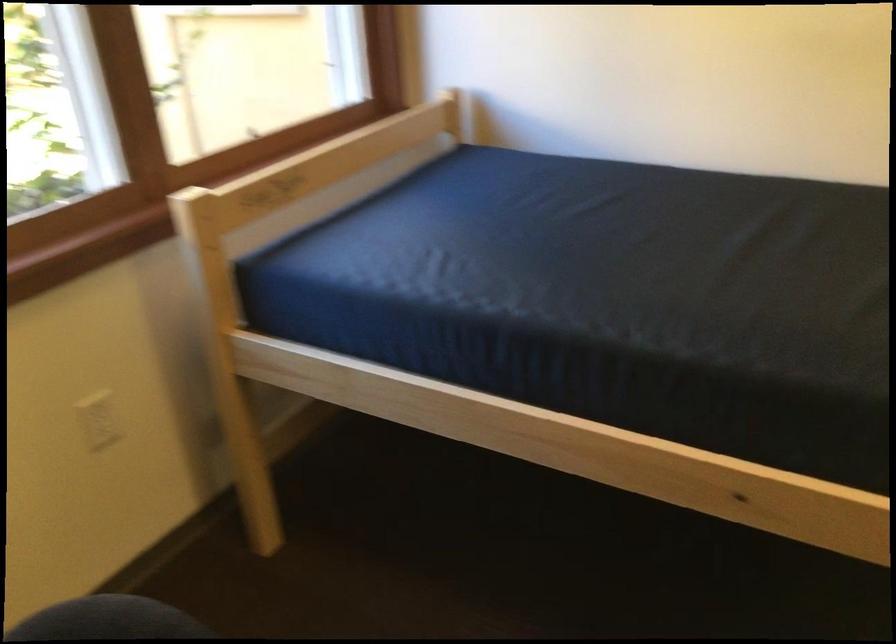
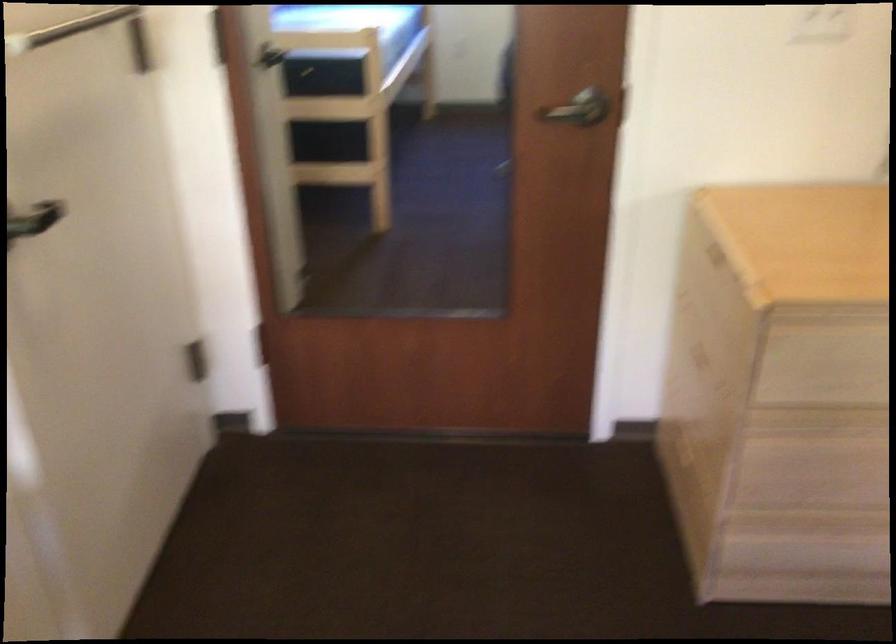
Based on the continuous images, in which direction is the camera rotating?

The rotation direction of the camera is right-down.